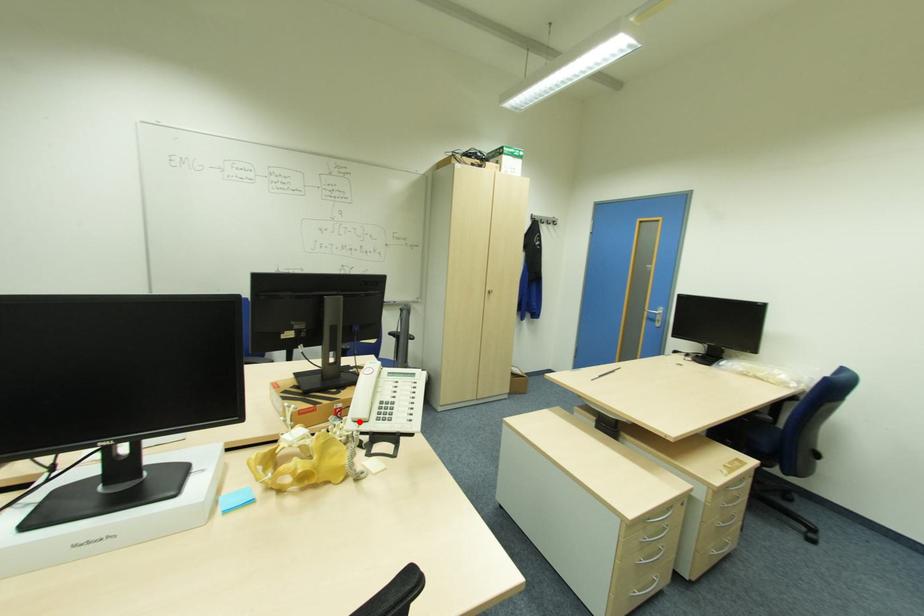
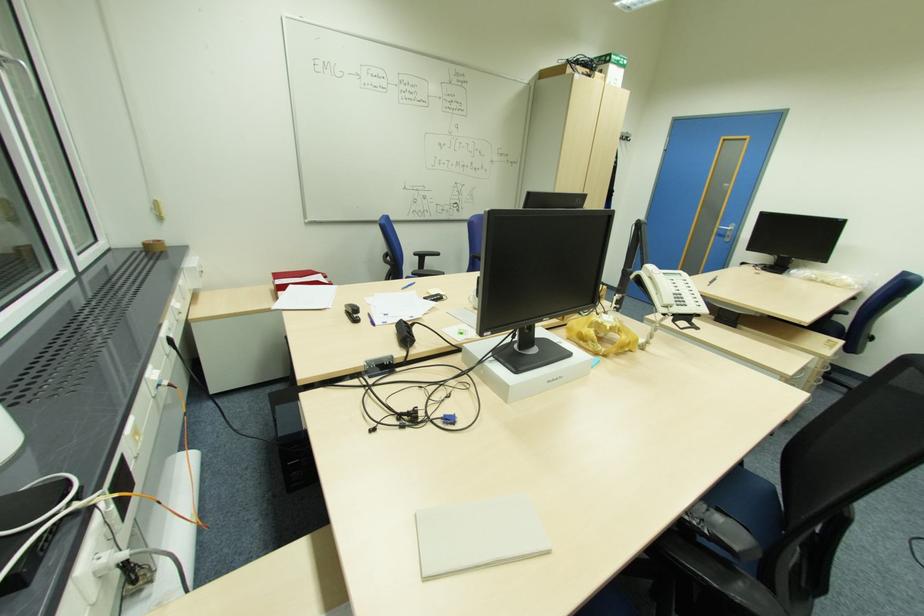
Question: A red point is marked in image1. In image2, is the corresponding 3D point closer to the camera or farther? Reply with the corresponding letter.

Choices:
 (A) The corresponding 3D point is closer.
 (B) The corresponding 3D point is farther.

Answer: (A)